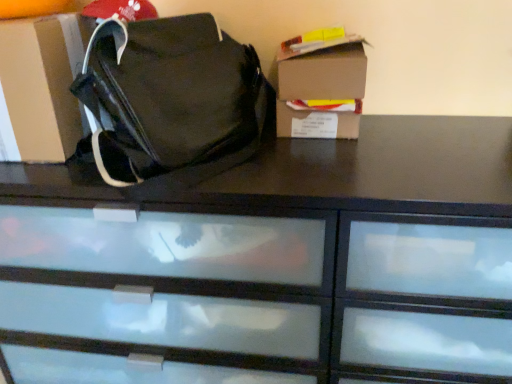
Question: Is matte black bag at center taller or shorter than cardboard box at left?

Choices:
 (A) tall
 (B) short

Answer: (A)

Question: Is matte black bag at center inside the boundaries of cardboard box at left, or outside?

Choices:
 (A) inside
 (B) outside

Answer: (B)

Question: Which of these objects is positioned farthest from the cardboard box at left?

Choices:
 (A) black glossy chest of drawers at center
 (B) matte black bag at center
 (C) cardboard box at upper right

Answer: (C)

Question: Considering the real-world distances, which object is closest to the cardboard box at left?

Choices:
 (A) matte black bag at center
 (B) cardboard box at upper right
 (C) black glossy chest of drawers at center

Answer: (A)